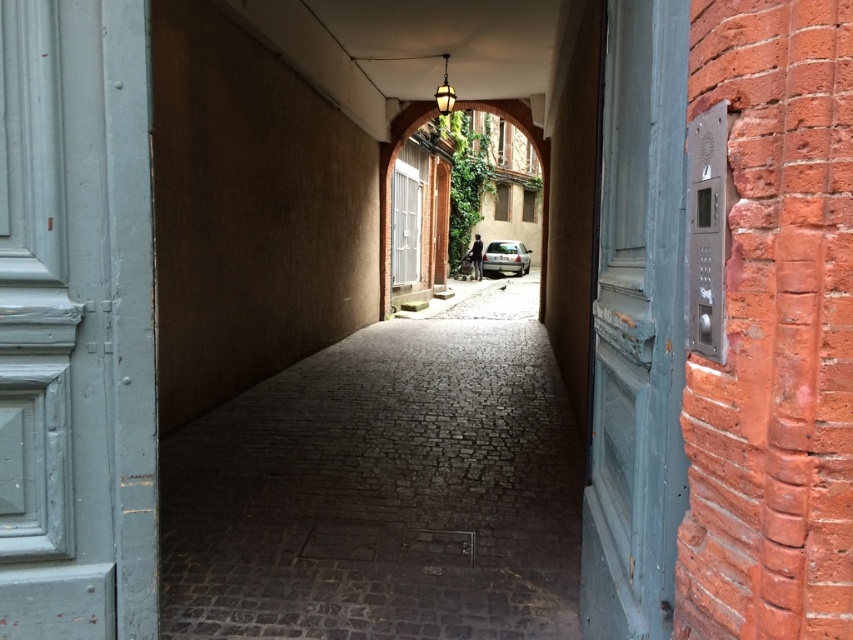
Question: Among these objects, which one is nearest to the camera?

Choices:
 (A) gray cobblestone path at center
 (B) brown stone archway at center
 (C) chipped paint door at right
 (D) silver metallic car at center

Answer: (C)

Question: Which of the following is the closest to the observer?

Choices:
 (A) chipped paint door at right
 (B) gray cobblestone path at center

Answer: (A)

Question: Does chipped paint door at right have a larger size compared to silver metallic car at center?

Choices:
 (A) yes
 (B) no

Answer: (B)

Question: Is gray cobblestone path at center wider than brown stone archway at center?

Choices:
 (A) no
 (B) yes

Answer: (B)

Question: Which of the following is the closest to the observer?

Choices:
 (A) gray cobblestone path at center
 (B) chipped paint door at right
 (C) brown stone archway at center
 (D) silver metallic car at center

Answer: (B)

Question: Can you confirm if gray cobblestone path at center is positioned to the left of brown stone archway at center?

Choices:
 (A) yes
 (B) no

Answer: (B)